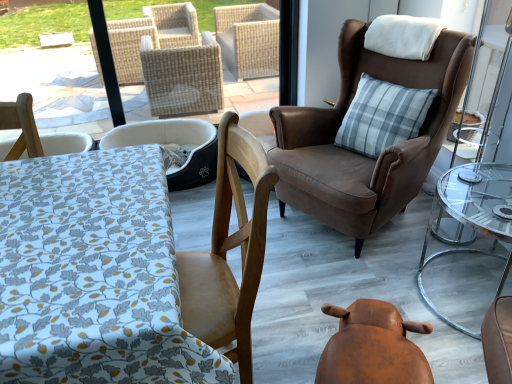
Question: From the image's perspective, is gray plaid pillow at upper right beneath white fabric pet bed at center, acting as the first chair starting from the left?

Choices:
 (A) no
 (B) yes

Answer: (A)

Question: Could you tell me if gray plaid pillow at upper right is turned towards white fabric pet bed at center, acting as the first chair starting from the left?

Choices:
 (A) no
 (B) yes

Answer: (A)

Question: Is gray plaid pillow at upper right outside white fabric pet bed at center, the third chair viewed from the right?

Choices:
 (A) no
 (B) yes

Answer: (B)

Question: From a real-world perspective, is gray plaid pillow at upper right physically above white fabric pet bed at center, the third chair viewed from the right?

Choices:
 (A) no
 (B) yes

Answer: (B)

Question: Is gray plaid pillow at upper right facing away from white fabric pet bed at center, the third chair viewed from the right?

Choices:
 (A) yes
 (B) no

Answer: (B)

Question: From the image's perspective, is wooden chair at left, acting as the 2th chair starting from the right, above or below clear glass table at right?

Choices:
 (A) above
 (B) below

Answer: (B)

Question: In terms of width, does wooden chair at left, acting as the 2th chair starting from the right, look wider or thinner when compared to clear glass table at right?

Choices:
 (A) wide
 (B) thin

Answer: (B)

Question: In the image, is wooden chair at left, acting as the 2th chair starting from the right, positioned in front of or behind clear glass table at right?

Choices:
 (A) front
 (B) behind

Answer: (A)

Question: In terms of height, does wooden chair at left, which is the 2th chair from left to right, look taller or shorter compared to clear glass table at right?

Choices:
 (A) short
 (B) tall

Answer: (B)

Question: Is point (326, 349) positioned closer to the camera than point (412, 61)?

Choices:
 (A) closer
 (B) farther

Answer: (A)

Question: In terms of size, does brown leather swivel chair at lower center appear bigger or smaller than brown suede armchair at upper right, the 3th chair viewed from the left?

Choices:
 (A) small
 (B) big

Answer: (A)

Question: From the image's perspective, relative to brown suede armchair at upper right, the 3th chair viewed from the left, is brown leather swivel chair at lower center above or below?

Choices:
 (A) below
 (B) above

Answer: (A)

Question: Is brown leather swivel chair at lower center wider or thinner than brown suede armchair at upper right, the 3th chair viewed from the left?

Choices:
 (A) wide
 (B) thin

Answer: (B)

Question: Based on their sizes in the image, would you say gray plaid pillow at upper right is bigger or smaller than brown suede armchair at upper right, which is counted as the 1th chair, starting from the right?

Choices:
 (A) big
 (B) small

Answer: (B)

Question: Does point (375, 94) appear closer or farther from the camera than point (415, 163)?

Choices:
 (A) closer
 (B) farther

Answer: (B)